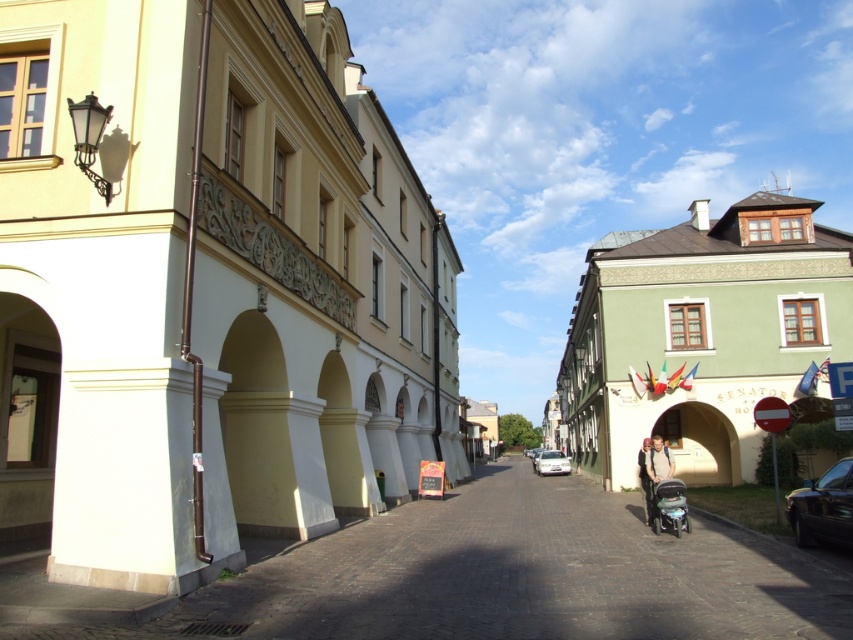
You are a tour guide leading a group through the historic town. You want to point out the beige stone archway at center and the metallic silver motorcycle at lower right. Which object is taller?

The beige stone archway at center is taller than the metallic silver motorcycle at lower right.

You are a delivery person who needs to park your vehicle in this street scene. You have a metallic silver motorcycle at lower right and a white glossy car at center. Which vehicle would require less space to park?

The metallic silver motorcycle at lower right occupies less space than the white glossy car at center, so it would require less space to park.

You are standing at the entrance of the street and want to take a photo of the beige stone archway at center. If your camera has a zoom lens that can focus on objects within a 0.5 radius from the center point, will the archway be in focus?

The beige stone archway at center is located at position point (700, 444). Since the camera can focus within a 0.5 radius from the center point, the distance between the archway and the center point is sqrt of squared differences between 0.694 and 0.5 and 0.822 and 0.5. Calculating that, the distance is sqrt of 0.194 squared plus 0.322 squared. 0.194 squared is 0.0376, and 0.322 squared is 0.103684. Adding them gives 0.141284. The square root of that is approximately 0.376, which is less than 0.5. So yes,